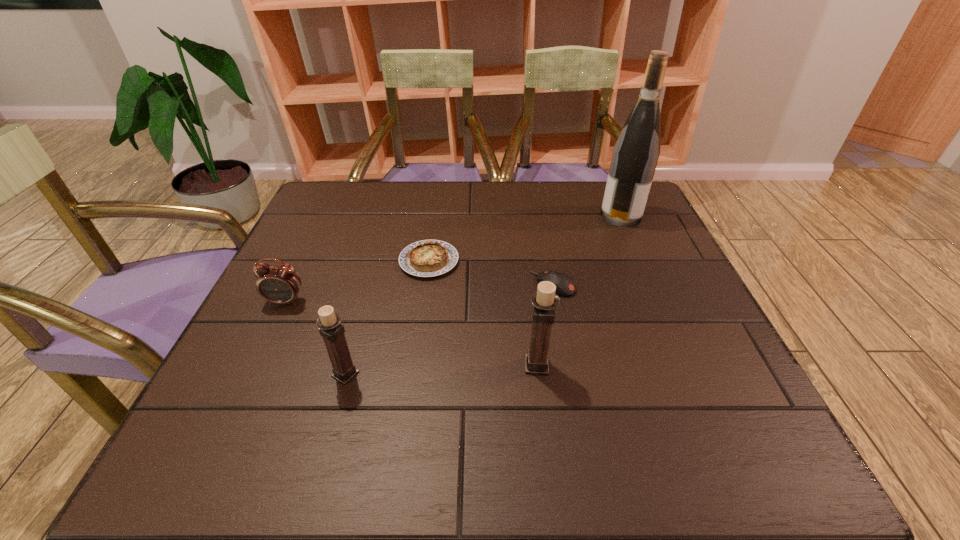
Identify the location of the third tallest object. This screenshot has width=960, height=540. (331, 330).

The width and height of the screenshot is (960, 540). What are the coordinates of `the left candle holder` in the screenshot? It's located at (331, 330).

The width and height of the screenshot is (960, 540). What are the coordinates of `the taller candle holder` in the screenshot? It's located at (544, 300).

Image resolution: width=960 pixels, height=540 pixels. In order to click on the fifth shortest object in this screenshot , I will do `click(544, 300)`.

This screenshot has width=960, height=540. Find the location of `quiche`. quiche is located at coordinates 427,258.

This screenshot has height=540, width=960. I want to click on the third object from left to right, so click(x=427, y=258).

Locate an element on the screen. the farthest object is located at coordinates (636, 152).

The height and width of the screenshot is (540, 960). Identify the location of wine bottle. (636, 152).

Locate an element on the screen. computer mouse is located at coordinates (564, 284).

At what (x,y) coordinates should I click in order to perform the action: click on alarm clock. Please return your answer as a coordinate pair (x, y). The width and height of the screenshot is (960, 540). Looking at the image, I should click on (280, 284).